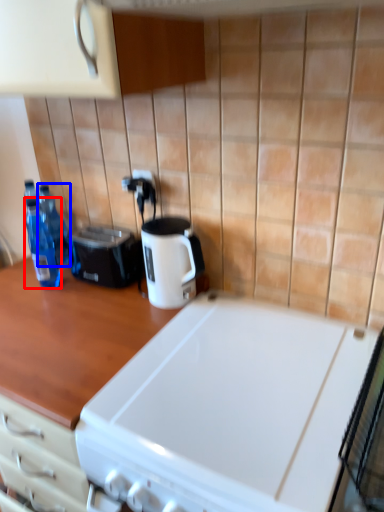
Question: Which point is closer to the camera, bottle (highlighted by a red box) or bottle (highlighted by a blue box)?

Choices:
 (A) bottle
 (B) bottle

Answer: (A)